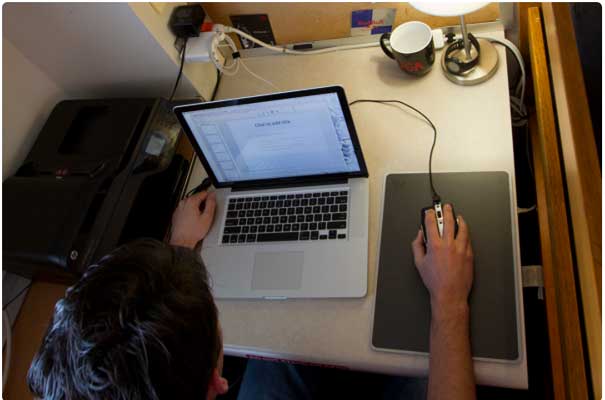
Where is `gray mouse pad`? gray mouse pad is located at coordinates (489, 213).